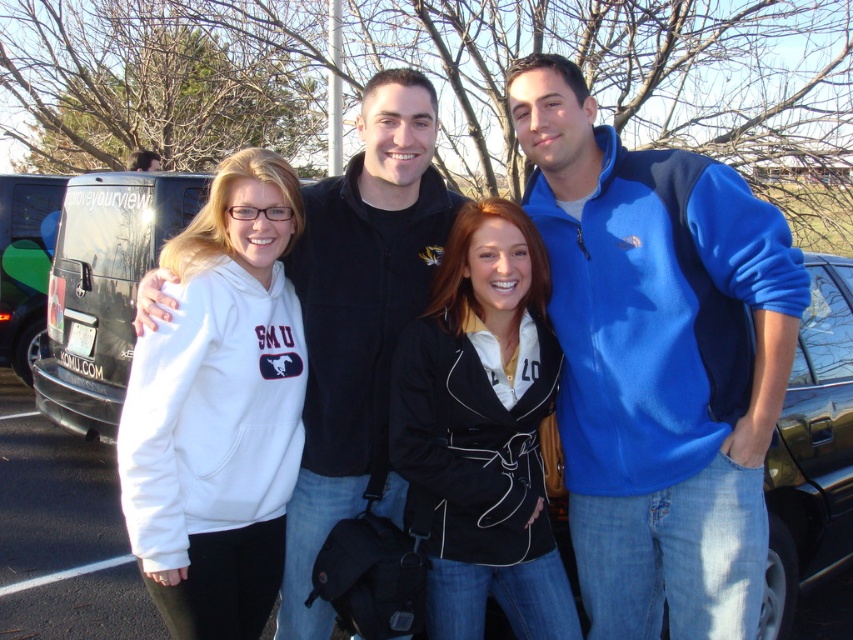
Looking at this image, you are a photographer trying to adjust the lighting for a group photo. You notice the white fleece hoodie at left and the black leather jacket at center. Which clothing item takes up more space in the frame?

The white fleece hoodie at left is larger in size than the black leather jacket at center, so it takes up more space in the frame.